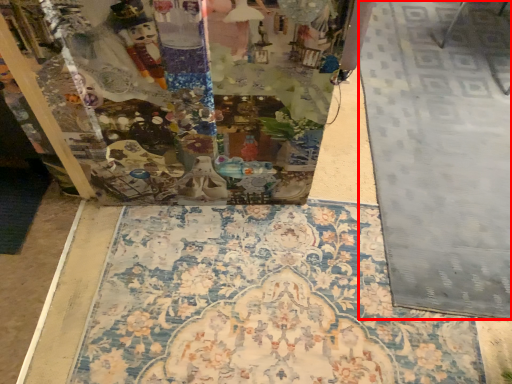
Question: From the image's perspective, what is the correct spatial relationship of tile (annotated by the red box) in relation to mat?

Choices:
 (A) above
 (B) below

Answer: (A)